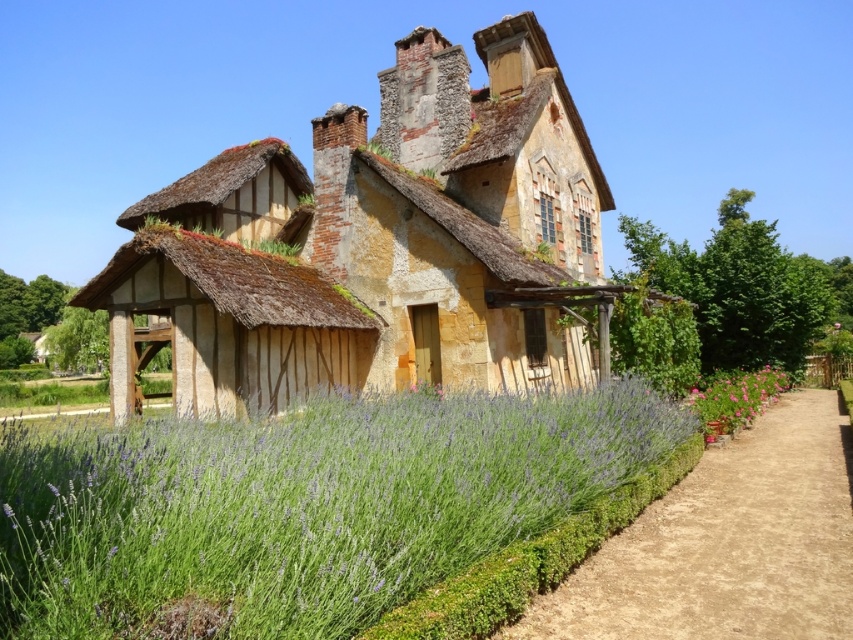
Question: Which point is closer to the camera?

Choices:
 (A) purple soft lavender at center
 (B) dirt path at center

Answer: (A)

Question: Is purple soft lavender at center smaller than dirt path at center?

Choices:
 (A) no
 (B) yes

Answer: (A)

Question: Can you confirm if purple soft lavender at center is positioned above dirt path at center?

Choices:
 (A) yes
 (B) no

Answer: (A)

Question: Is yellowish stone cottage at center closer to camera compared to purple soft lavender at center?

Choices:
 (A) yes
 (B) no

Answer: (B)

Question: Which object is closer to the camera taking this photo?

Choices:
 (A) purple soft-textured lavender at lower right
 (B) dirt path at center

Answer: (B)

Question: Considering the real-world distances, which object is farthest from the purple soft lavender at center?

Choices:
 (A) dirt path at center
 (B) yellowish stone cottage at center
 (C) purple soft-textured lavender at lower right

Answer: (C)